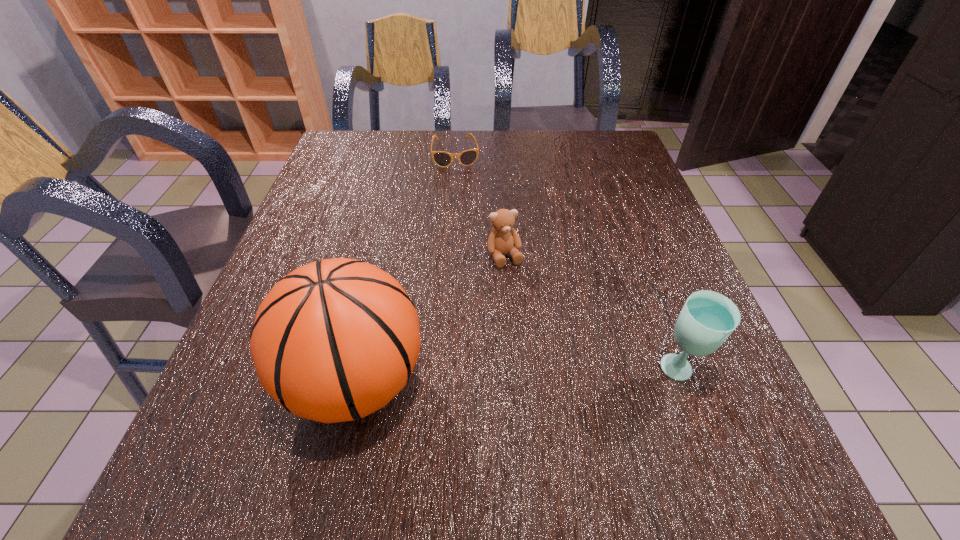
You are a GUI agent. You are given a task and a screenshot of the screen. Output one action in this format:
    pyautogui.click(x=<x>, y=<y>)
    Task: Click on the object at the near left corner
    Image resolution: width=960 pixels, height=540 pixels.
    Given the screenshot: What is the action you would take?
    pyautogui.click(x=334, y=340)

Where is `object situated at the near right corner`? This screenshot has height=540, width=960. object situated at the near right corner is located at coordinates (707, 318).

In the image, there is a desktop. Identify the location of vacant region at the far edge. The image size is (960, 540). (533, 160).

The height and width of the screenshot is (540, 960). What are the coordinates of `blank space at the left edge` in the screenshot? It's located at (346, 216).

Where is `vacant space at the right edge`? The height and width of the screenshot is (540, 960). vacant space at the right edge is located at coordinates (612, 256).

At what (x,y) coordinates should I click in order to perform the action: click on vacant region at the far right corner of the desktop. Please return your answer as a coordinate pair (x, y). The height and width of the screenshot is (540, 960). Looking at the image, I should click on (593, 138).

Locate an element on the screen. free space between the farthest object and the tallest object is located at coordinates (406, 268).

Where is `vacant region between the shortest object and the rightmost object`? vacant region between the shortest object and the rightmost object is located at coordinates (567, 262).

I want to click on vacant space that is in between the rightmost object and the third nearest object, so click(592, 314).

At what (x,y) coordinates should I click in order to perform the action: click on vacant point located between the sunglasses and the second tallest object. Please return your answer as a coordinate pair (x, y). The image size is (960, 540). Looking at the image, I should click on (567, 262).